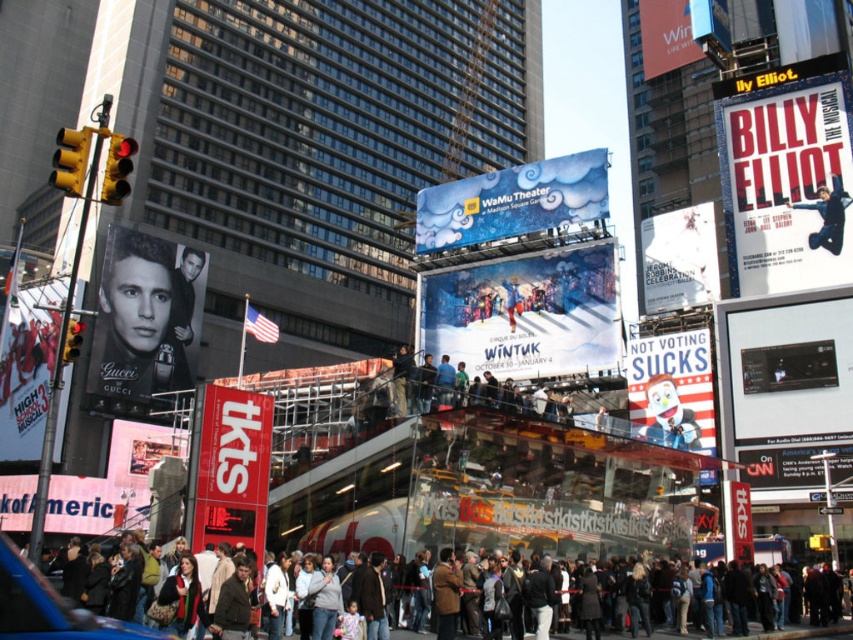
You are an event planner trying to place a new advertisement in Times Square. You have two options for placement locations between the matte blue poster at center and the blue fabric billboard at center. Which option would allow your advertisement to be seen by more people, and why?

The blue fabric billboard at center would allow your advertisement to be seen by more people because it occupies more space than the matte blue poster at center.

You are standing in Times Square and see a red matte sign at lower left. There is a point marked at coordinates (234, 445). Is this point located on the sign?

Yes, the point marked at coordinates (234, 445) is located on the red matte sign at lower left as stated in the description.